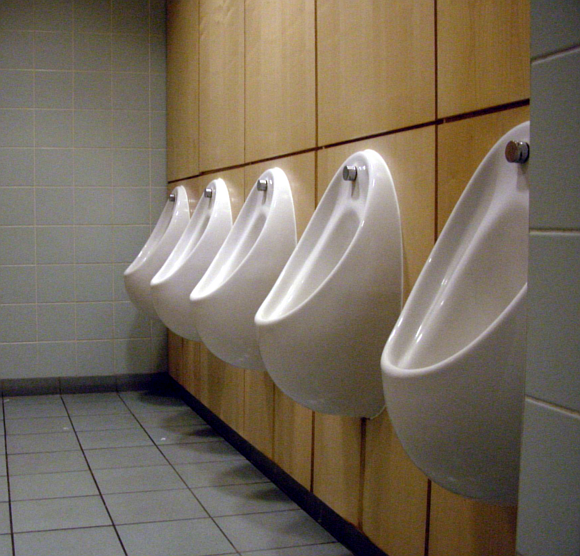
Image resolution: width=580 pixels, height=556 pixels. I want to click on urinal, so click(x=492, y=345), click(x=321, y=302), click(x=239, y=264), click(x=184, y=255), click(x=152, y=260).